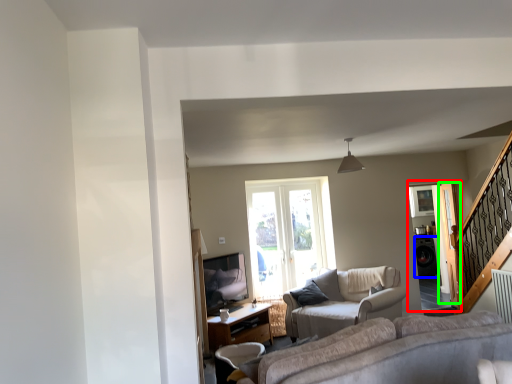
Question: Based on their relative distances, which object is nearer to screen door (highlighted by a red box)? Choose from appliance (highlighted by a blue box) and screen door (highlighted by a green box).

Choices:
 (A) appliance
 (B) screen door

Answer: (B)